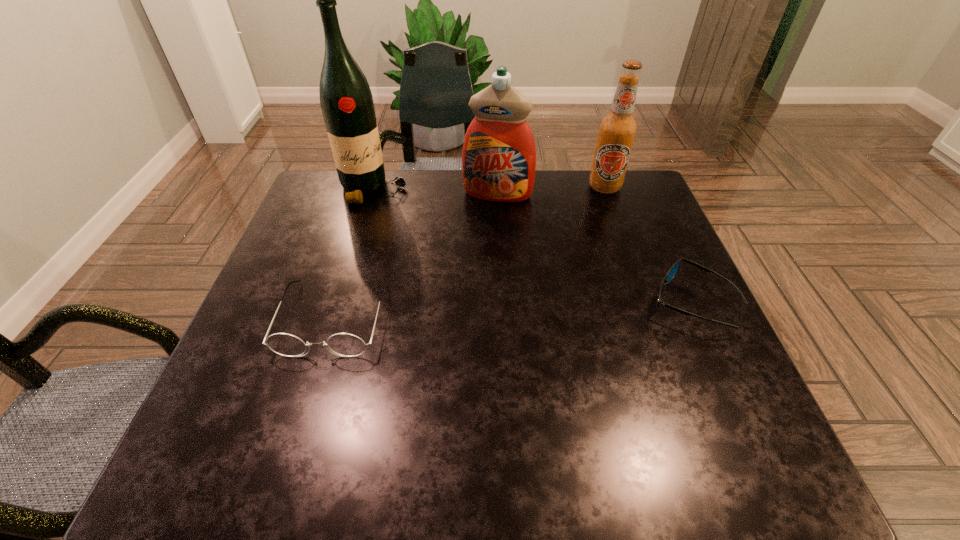
Locate an element on the screen. This screenshot has height=540, width=960. free space located 0.070m on the front surface of the third object from left to right is located at coordinates (489, 219).

Find the location of `vacant area situated on the front surface of the third object from left to right`. vacant area situated on the front surface of the third object from left to right is located at coordinates (468, 309).

Locate an element on the screen. This screenshot has width=960, height=540. vacant area situated on the surface of the tallest object is located at coordinates (410, 237).

Identify the location of vacant space located on the surface of the tallest object. The width and height of the screenshot is (960, 540). (428, 262).

At what (x,y) coordinates should I click in order to perform the action: click on free space located 0.340m on the surface of the tallest object. Please return your answer as a coordinate pair (x, y). Image resolution: width=960 pixels, height=540 pixels. Looking at the image, I should click on (442, 280).

Where is `blank space located 0.080m on the front label of the beer bottle`? The image size is (960, 540). blank space located 0.080m on the front label of the beer bottle is located at coordinates (595, 212).

The image size is (960, 540). What are the coordinates of `vacant space located 0.150m on the front label of the beer bottle` in the screenshot? It's located at (590, 227).

This screenshot has width=960, height=540. Identify the location of free location located on the front label of the beer bottle. (577, 264).

Image resolution: width=960 pixels, height=540 pixels. I want to click on detergent present at the far edge, so click(x=499, y=157).

Identify the location of wine bottle positioned at the far edge. (346, 101).